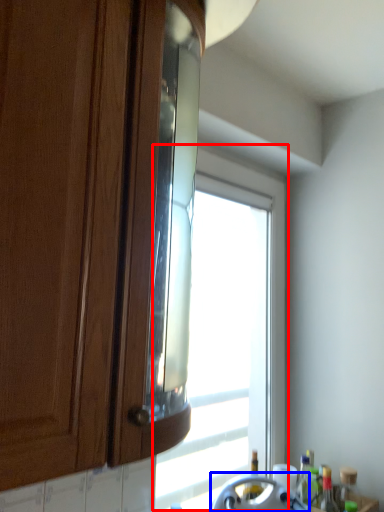
Question: Which object appears farthest to the camera in this image, window (highlighted by a red box) or appliance (highlighted by a blue box)?

Choices:
 (A) window
 (B) appliance

Answer: (A)